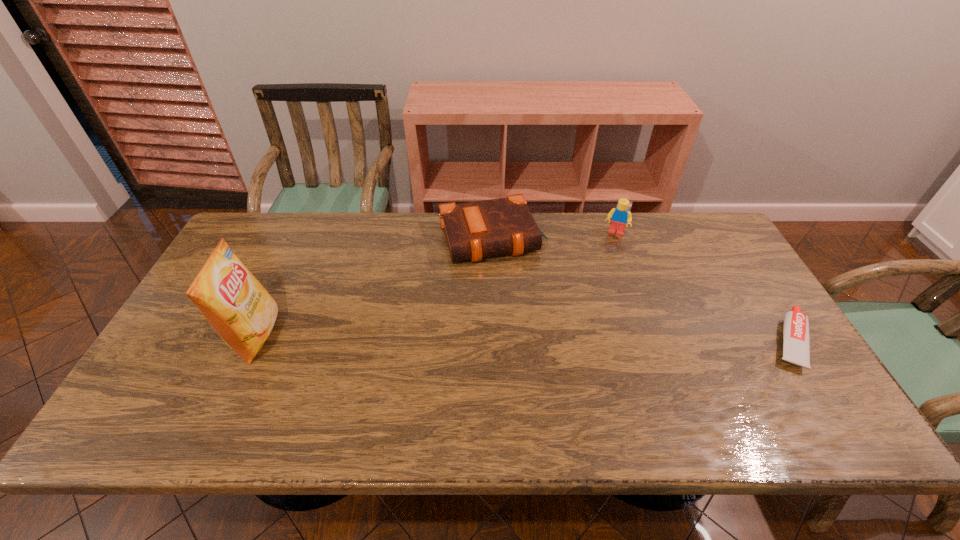
Where is `the leftmost object`? The width and height of the screenshot is (960, 540). the leftmost object is located at coordinates (241, 311).

Where is `crisp (potato chip)`? The image size is (960, 540). crisp (potato chip) is located at coordinates (241, 311).

Find the location of a particular element. This screenshot has width=960, height=540. the shortest object is located at coordinates (796, 342).

In order to click on toothpaste in this screenshot , I will do `click(796, 342)`.

Identify the location of the second object from left to right. The height and width of the screenshot is (540, 960). (x=474, y=230).

This screenshot has width=960, height=540. I want to click on Bible, so click(x=474, y=230).

Locate an element on the screen. This screenshot has height=540, width=960. the second tallest object is located at coordinates (619, 216).

You are a GUI agent. You are given a task and a screenshot of the screen. Output one action in this format:
    pyautogui.click(x=<x>, y=<y>)
    Task: Click on the third object from left to right
    
    Given the screenshot: What is the action you would take?
    pos(619,216)

Identify the location of vacant space located on the front-facing side of the tallest object. (320, 336).

This screenshot has height=540, width=960. Identify the location of blank space located on the left of the rightmost object. (695, 341).